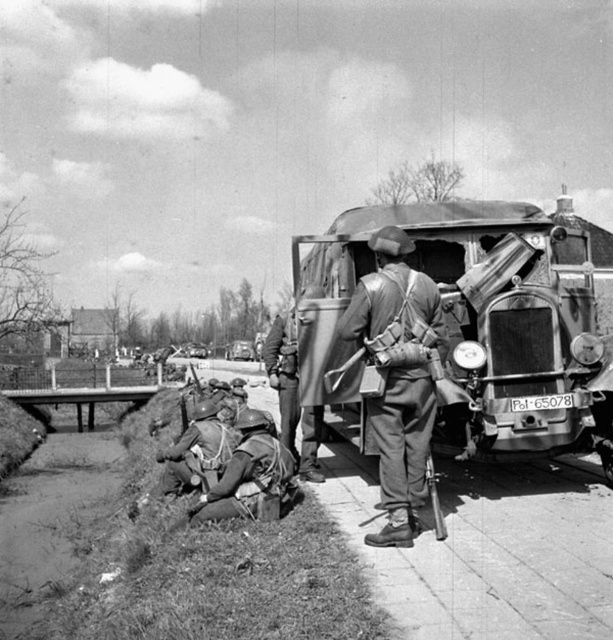
Who is higher up, leather jacket at center or camouflage fabric helmet at lower left?

leather jacket at center

Is point (435, 328) closer to camera compared to point (210, 468)?

Yes, it is.

Image resolution: width=613 pixels, height=640 pixels. What do you see at coordinates (397, 376) in the screenshot?
I see `leather jacket at center` at bounding box center [397, 376].

Find the location of a particular element. leather jacket at center is located at coordinates (397, 376).

How much distance is there between camouflage fabric soldier at lower left and camouflage fabric helmet at lower left?

They are 38.00 inches apart.

Does camouflage fabric soldier at lower left lie behind camouflage fabric helmet at lower left?

No, it is in front of camouflage fabric helmet at lower left.

Which is in front, point (229, 500) or point (199, 456)?

Point (229, 500)

Locate an element on the screen. Image resolution: width=613 pixels, height=640 pixels. camouflage fabric soldier at lower left is located at coordinates (249, 476).

Does camouflage fabric soldier at lower left appear on the right side of smooth leather jacket at center?

In fact, camouflage fabric soldier at lower left is to the left of smooth leather jacket at center.

Is point (224, 499) closer to viewer compared to point (287, 400)?

Yes, it is.

The image size is (613, 640). Find the location of `camouflage fabric soldier at lower left`. camouflage fabric soldier at lower left is located at coordinates click(249, 476).